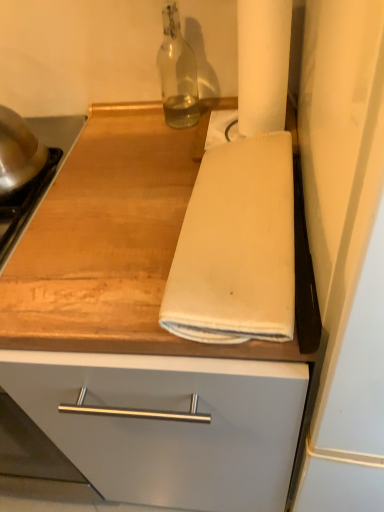
You are a GUI agent. You are given a task and a screenshot of the screen. Output one action in this format:
    pyautogui.click(x=<x>, y=<y>)
    Task: Click on the free space behind white cotton towel at center
    The width and height of the screenshot is (384, 512).
    Given the screenshot: What is the action you would take?
    pyautogui.click(x=150, y=156)